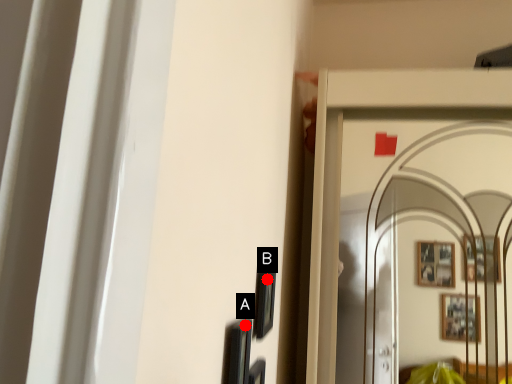
Question: Two points are circled on the image, labeled by A and B beside each circle. Which point is closer to the camera?

Choices:
 (A) A is closer
 (B) B is closer

Answer: (A)